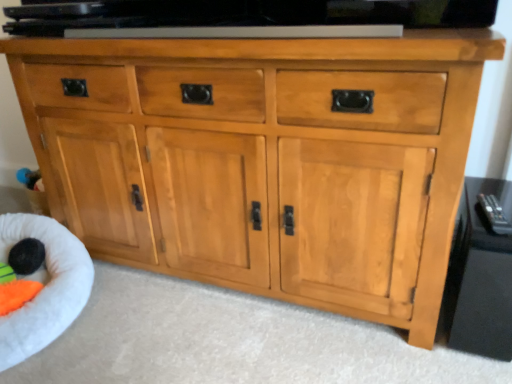
Question: Does glossy black tv stand at right have a lesser width compared to white plush infant bed at lower left?

Choices:
 (A) no
 (B) yes

Answer: (B)

Question: Is glossy black tv stand at right far away from white plush infant bed at lower left?

Choices:
 (A) yes
 (B) no

Answer: (A)

Question: From the image's perspective, is glossy black tv stand at right on white plush infant bed at lower left?

Choices:
 (A) yes
 (B) no

Answer: (A)

Question: Is glossy black tv stand at right positioned before white plush infant bed at lower left?

Choices:
 (A) no
 (B) yes

Answer: (B)

Question: Could you tell me if glossy black tv stand at right is facing white plush infant bed at lower left?

Choices:
 (A) no
 (B) yes

Answer: (A)

Question: Does glossy black tv stand at right have a smaller size compared to white plush infant bed at lower left?

Choices:
 (A) yes
 (B) no

Answer: (A)

Question: Is white plush infant bed at lower left further to camera compared to black fuzzy ball at lower left?

Choices:
 (A) no
 (B) yes

Answer: (A)

Question: From the image's perspective, is white plush infant bed at lower left located above black fuzzy ball at lower left?

Choices:
 (A) no
 (B) yes

Answer: (A)

Question: Considering the relative positions of white plush infant bed at lower left and black fuzzy ball at lower left in the image provided, is white plush infant bed at lower left to the right of black fuzzy ball at lower left from the viewer's perspective?

Choices:
 (A) yes
 (B) no

Answer: (B)

Question: Is white plush infant bed at lower left far from black fuzzy ball at lower left?

Choices:
 (A) no
 (B) yes

Answer: (A)

Question: From the image's perspective, does white plush infant bed at lower left appear lower than black fuzzy ball at lower left?

Choices:
 (A) yes
 (B) no

Answer: (A)

Question: Can you confirm if white plush infant bed at lower left is smaller than black fuzzy ball at lower left?

Choices:
 (A) yes
 (B) no

Answer: (B)

Question: Is glossy black tv stand at right positioned beyond the bounds of black fuzzy ball at lower left?

Choices:
 (A) yes
 (B) no

Answer: (A)